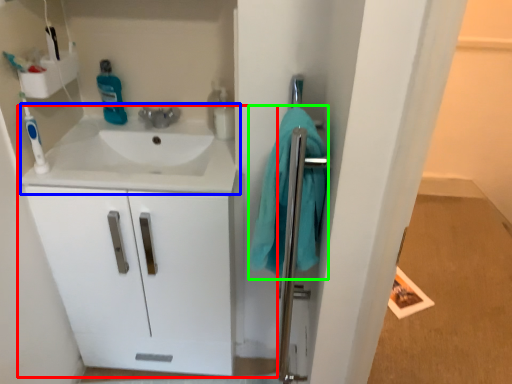
Question: Which object is the closest to the bathroom cabinet (highlighted by a red box)? Choose among these: sink (highlighted by a blue box) or bath towel (highlighted by a green box).

Choices:
 (A) sink
 (B) bath towel

Answer: (A)